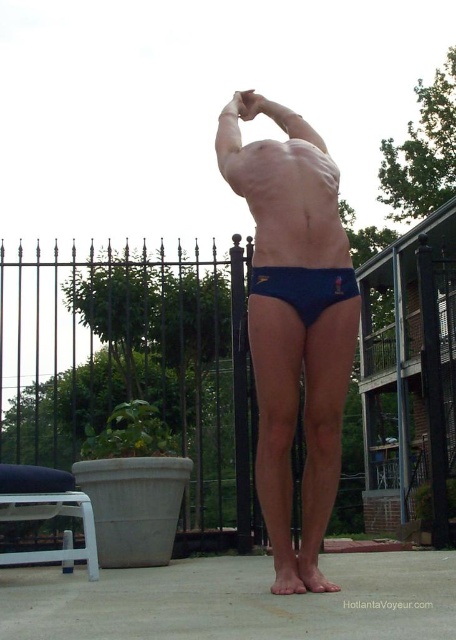
Question: Which point appears farthest from the camera in this image?

Choices:
 (A) (291, 305)
 (B) (316, 493)

Answer: (B)

Question: Is the position of blue matte underwear at center more distant than that of navy blue fabric briefs at center?

Choices:
 (A) yes
 (B) no

Answer: (B)

Question: Among these objects, which one is nearest to the camera?

Choices:
 (A) navy blue fabric briefs at center
 (B) blue matte underwear at center

Answer: (B)

Question: Can you confirm if blue matte underwear at center is positioned below navy blue fabric briefs at center?

Choices:
 (A) yes
 (B) no

Answer: (A)

Question: Which of the following is the farthest from the observer?

Choices:
 (A) (352, 276)
 (B) (307, 228)

Answer: (A)

Question: Can you confirm if blue matte underwear at center is positioned to the left of navy blue fabric briefs at center?

Choices:
 (A) yes
 (B) no

Answer: (A)